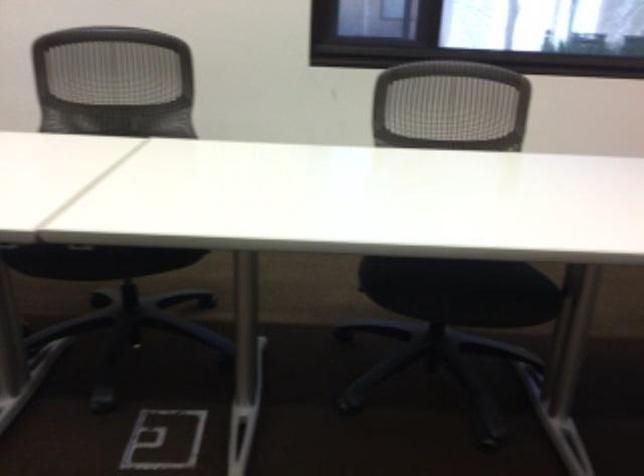
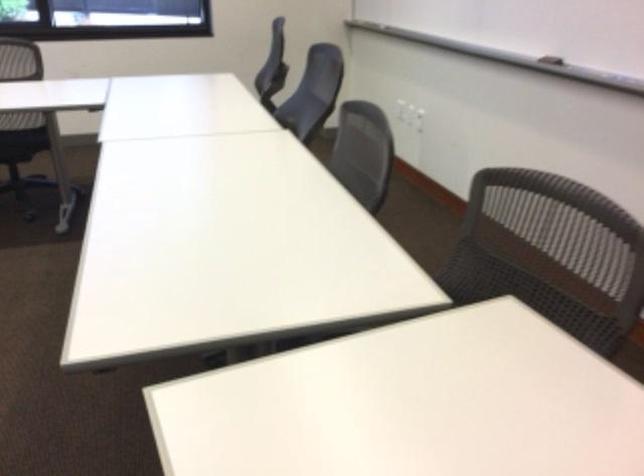
The point at (531, 278) is marked in the first image. Where is the corresponding point in the second image?

(22, 143)